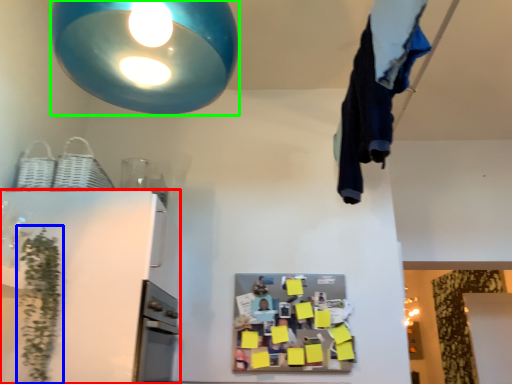
Question: Considering the real-world distances, which object is closest to appliance (highlighted by a red box)? plant (highlighted by a blue box) or lamp (highlighted by a green box).

Choices:
 (A) plant
 (B) lamp

Answer: (A)